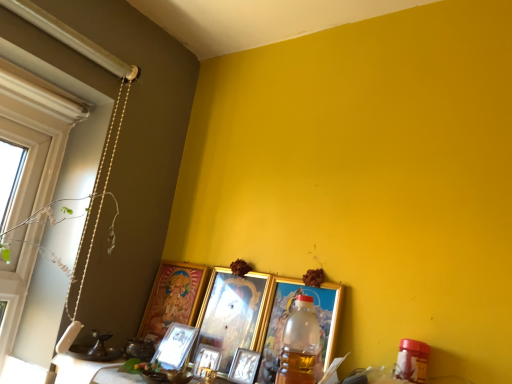
Question: Is gold metallic picture frame at center, the third picture frame positioned from the right, at the right side of metallic gold picture frame at center, the fifth picture frame when ordered from left to right?

Choices:
 (A) yes
 (B) no

Answer: (B)

Question: Considering the relative sizes of gold metallic picture frame at center, the third picture frame positioned from the right, and metallic gold picture frame at center, the second picture frame from the right, in the image provided, is gold metallic picture frame at center, the third picture frame positioned from the right, thinner than metallic gold picture frame at center, the second picture frame from the right,?

Choices:
 (A) no
 (B) yes

Answer: (A)

Question: Can you confirm if gold metallic picture frame at center, which is counted as the 4th picture frame, starting from the left, is bigger than metallic gold picture frame at center, the fifth picture frame when ordered from left to right?

Choices:
 (A) yes
 (B) no

Answer: (A)

Question: From the image's perspective, would you say gold metallic picture frame at center, the third picture frame positioned from the right, is shown under metallic gold picture frame at center, the second picture frame from the right?

Choices:
 (A) no
 (B) yes

Answer: (A)

Question: From the image's perspective, is gold metallic picture frame at center, which is counted as the 4th picture frame, starting from the left, on top of metallic gold picture frame at center, the second picture frame from the right?

Choices:
 (A) yes
 (B) no

Answer: (A)

Question: Is gold metallic picture frame at center, the third picture frame positioned from the right, closer to camera compared to metallic gold picture frame at center, the second picture frame from the right?

Choices:
 (A) yes
 (B) no

Answer: (B)

Question: From the image's perspective, is gold metallic picture frame at center, arranged as the first picture frame when viewed from the right, below gold-framed picture at lower left, the 6th picture frame positioned from the right?

Choices:
 (A) yes
 (B) no

Answer: (A)

Question: Is gold metallic picture frame at center, which is the 6th picture frame from left to right, facing away from gold-framed picture at lower left, the first picture frame from the left?

Choices:
 (A) yes
 (B) no

Answer: (B)

Question: Considering the relative sizes of gold metallic picture frame at center, which is the 6th picture frame from left to right, and gold-framed picture at lower left, the 6th picture frame positioned from the right, in the image provided, is gold metallic picture frame at center, which is the 6th picture frame from left to right, shorter than gold-framed picture at lower left, the 6th picture frame positioned from the right,?

Choices:
 (A) no
 (B) yes

Answer: (B)

Question: Can you confirm if gold metallic picture frame at center, which is the 6th picture frame from left to right, is bigger than gold-framed picture at lower left, the first picture frame from the left?

Choices:
 (A) yes
 (B) no

Answer: (B)

Question: Is gold metallic picture frame at center, which is the 6th picture frame from left to right, taller than gold-framed picture at lower left, the first picture frame from the left?

Choices:
 (A) yes
 (B) no

Answer: (B)

Question: Is gold metallic picture frame at center, arranged as the first picture frame when viewed from the right, further to camera compared to gold-framed picture at lower left, the first picture frame from the left?

Choices:
 (A) no
 (B) yes

Answer: (A)

Question: Considering the relative sizes of white matte window at left and metallic silver picture frame at center, acting as the 3th picture frame starting from the left, in the image provided, is white matte window at left bigger than metallic silver picture frame at center, acting as the 3th picture frame starting from the left,?

Choices:
 (A) no
 (B) yes

Answer: (B)